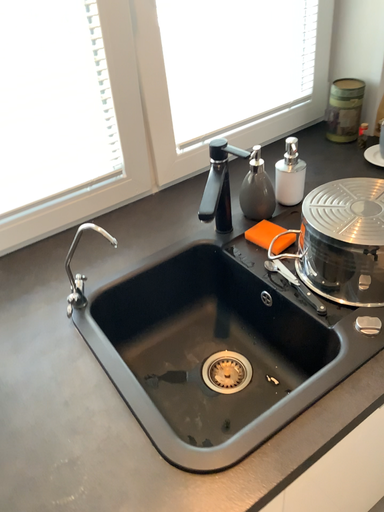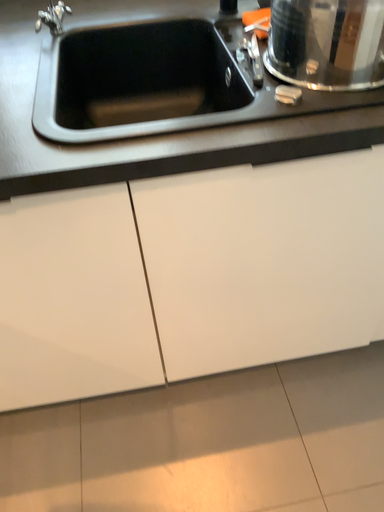
Question: Which way did the camera rotate in the video?

Choices:
 (A) rotated downward
 (B) rotated upward

Answer: (A)